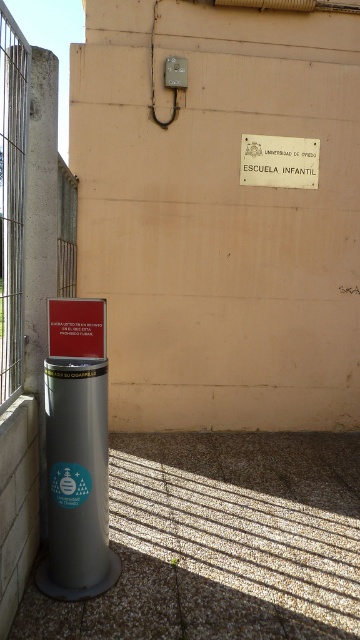
Measure the distance between point (276, 152) and camera.

Point (276, 152) is 5.26 meters from camera.

Does white matte sign at upper center appear on the left side of metallic sign at center?

No, white matte sign at upper center is not to the left of metallic sign at center.

You are a GUI agent. You are given a task and a screenshot of the screen. Output one action in this format:
    pyautogui.click(x=<x>, y=<y>)
    Task: Click on the white matte sign at upper center
    This screenshot has height=640, width=360.
    Given the screenshot: What is the action you would take?
    pyautogui.click(x=279, y=161)

Who is more forward, (x=7, y=173) or (x=59, y=301)?

Point (x=7, y=173) is in front.

Does concrete fence at left have a larger size compared to metallic sign at center?

Yes, concrete fence at left is bigger than metallic sign at center.

This screenshot has height=640, width=360. I want to click on concrete fence at left, so click(x=11, y=198).

You are a GUI agent. You are given a task and a screenshot of the screen. Output one action in this format:
    pyautogui.click(x=<x>, y=<y>)
    Task: Click on the concrete fence at left
    
    Given the screenshot: What is the action you would take?
    pyautogui.click(x=11, y=198)

Between concrete fence at left and white matte sign at upper center, which one is positioned lower?

concrete fence at left

Between concrete fence at left and white matte sign at upper center, which one has more height?

concrete fence at left

Describe the element at coordinates (11, 198) in the screenshot. The height and width of the screenshot is (640, 360). I see `concrete fence at left` at that location.

At what (x,y) coordinates should I click in order to perform the action: click on concrete fence at left. Please return your answer as a coordinate pair (x, y). This screenshot has width=360, height=640. Looking at the image, I should click on (11, 198).